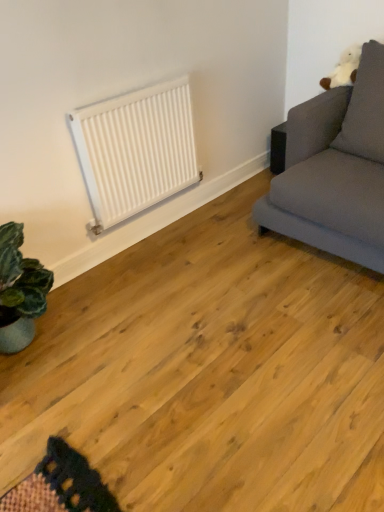
Question: Does gray fabric couch at upper right touch white plush pillow at upper right?

Choices:
 (A) no
 (B) yes

Answer: (A)

Question: From the image's perspective, is gray fabric couch at upper right located beneath white plush pillow at upper right?

Choices:
 (A) yes
 (B) no

Answer: (A)

Question: Does gray fabric couch at upper right come behind white plush pillow at upper right?

Choices:
 (A) no
 (B) yes

Answer: (A)

Question: Considering the relative sizes of gray fabric couch at upper right and white plush pillow at upper right in the image provided, is gray fabric couch at upper right wider than white plush pillow at upper right?

Choices:
 (A) yes
 (B) no

Answer: (A)

Question: Is gray fabric couch at upper right positioned with its back to white plush pillow at upper right?

Choices:
 (A) no
 (B) yes

Answer: (B)

Question: From the image's perspective, is gray fabric couch at upper right above white plush pillow at upper right?

Choices:
 (A) yes
 (B) no

Answer: (B)

Question: Is white matte radiator at upper center in front of white plush pillow at upper right?

Choices:
 (A) yes
 (B) no

Answer: (B)

Question: Is white plush pillow at upper right inside white matte radiator at upper center?

Choices:
 (A) no
 (B) yes

Answer: (A)

Question: Is white matte radiator at upper center to the right of white plush pillow at upper right from the viewer's perspective?

Choices:
 (A) yes
 (B) no

Answer: (B)

Question: From the image's perspective, is white matte radiator at upper center beneath white plush pillow at upper right?

Choices:
 (A) no
 (B) yes

Answer: (B)

Question: Does white matte radiator at upper center turn towards white plush pillow at upper right?

Choices:
 (A) yes
 (B) no

Answer: (B)

Question: Does white matte radiator at upper center have a smaller size compared to white plush pillow at upper right?

Choices:
 (A) no
 (B) yes

Answer: (B)

Question: From the image's perspective, would you say gray fabric couch at upper right is shown under white matte radiator at upper center?

Choices:
 (A) yes
 (B) no

Answer: (B)